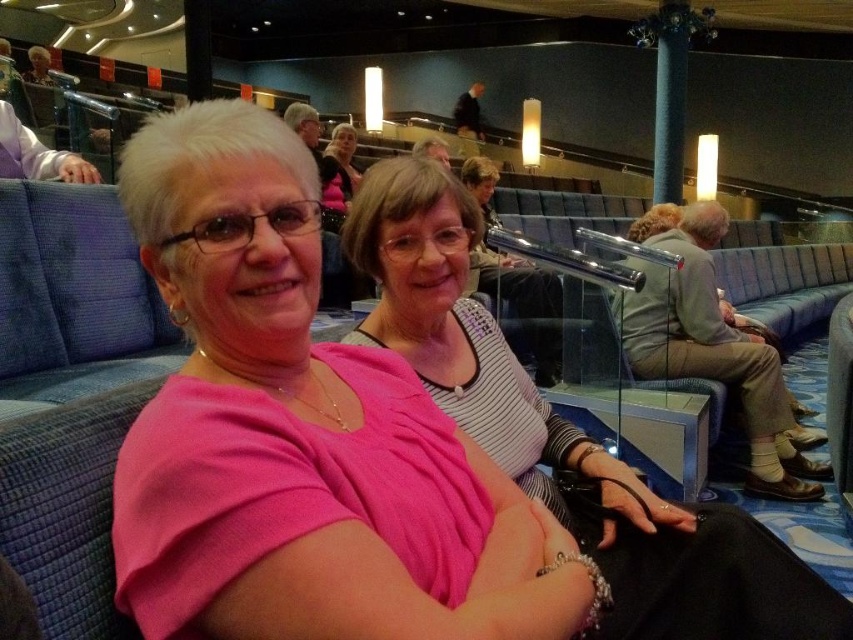
Which of these two, striped fabric shirt at center or matte black shirt at center, stands shorter?

With less height is matte black shirt at center.

At what (x,y) coordinates should I click in order to perform the action: click on striped fabric shirt at center. Please return your answer as a coordinate pair (x, y). This screenshot has height=640, width=853. Looking at the image, I should click on (473, 340).

Identify the location of striped fabric shirt at center. This screenshot has height=640, width=853. (473, 340).

Is pink fabric shirt at center positioned before matte black shirt at center?

Yes, it is.

Who is lower down, pink fabric shirt at center or matte black shirt at center?

pink fabric shirt at center is lower down.

Image resolution: width=853 pixels, height=640 pixels. What do you see at coordinates (364, 458) in the screenshot? I see `pink fabric shirt at center` at bounding box center [364, 458].

Identify the location of pink fabric shirt at center. (364, 458).

Between pink fabric shirt at center and striped fabric shirt at center, which one has less height?

pink fabric shirt at center

Does pink fabric shirt at center appear on the right side of striped fabric shirt at center?

Incorrect, pink fabric shirt at center is not on the right side of striped fabric shirt at center.

The height and width of the screenshot is (640, 853). I want to click on pink fabric shirt at center, so click(x=364, y=458).